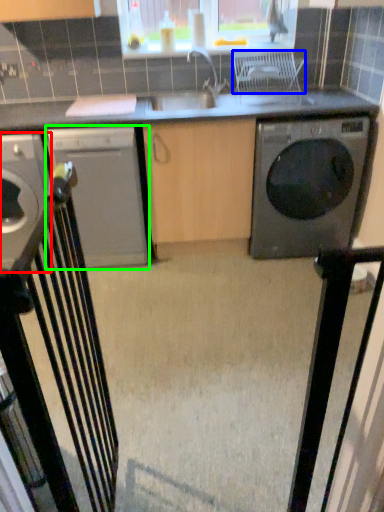
Question: Which object is positioned closest to home appliance (highlighted by a red box)? Select from chair (highlighted by a blue box) and home appliance (highlighted by a green box).

Choices:
 (A) chair
 (B) home appliance

Answer: (B)